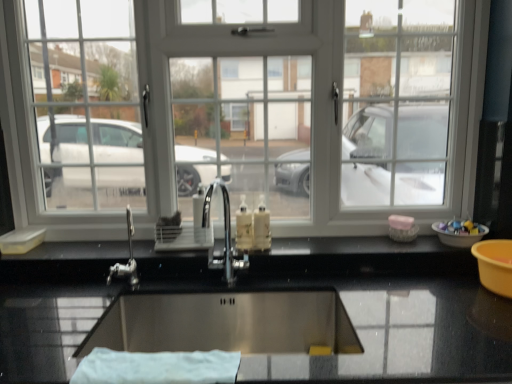
Question: From a real-world perspective, is white cloth at lower center over white plastic bowl at right?

Choices:
 (A) no
 (B) yes

Answer: (A)

Question: Could you tell me if white cloth at lower center is turned towards white plastic bowl at right?

Choices:
 (A) yes
 (B) no

Answer: (B)

Question: Considering the relative sizes of white cloth at lower center and white plastic bowl at right in the image provided, is white cloth at lower center taller than white plastic bowl at right?

Choices:
 (A) yes
 (B) no

Answer: (B)

Question: From a real-world perspective, is white cloth at lower center positioned under white plastic bowl at right based on gravity?

Choices:
 (A) no
 (B) yes

Answer: (B)

Question: Can white plastic bowl at right be found inside white cloth at lower center?

Choices:
 (A) yes
 (B) no

Answer: (B)

Question: Is white cloth at lower center wider or thinner than translucent plastic soap dispenser at center?

Choices:
 (A) wide
 (B) thin

Answer: (A)

Question: Would you say white cloth at lower center is to the left or to the right of translucent plastic soap dispenser at center in the picture?

Choices:
 (A) right
 (B) left

Answer: (B)

Question: Is point (219, 362) positioned closer to the camera than point (249, 211)?

Choices:
 (A) farther
 (B) closer

Answer: (B)

Question: Considering the positions of white cloth at lower center and translucent plastic soap dispenser at center in the image, is white cloth at lower center bigger or smaller than translucent plastic soap dispenser at center?

Choices:
 (A) big
 (B) small

Answer: (A)

Question: Is point (139, 314) positioned closer to the camera than point (449, 109)?

Choices:
 (A) closer
 (B) farther

Answer: (A)

Question: Would you say stainless steel sink at center is inside or outside white plastic window at center?

Choices:
 (A) outside
 (B) inside

Answer: (A)

Question: Is stainless steel sink at center taller or shorter than white plastic window at center?

Choices:
 (A) short
 (B) tall

Answer: (A)

Question: In the image, is stainless steel sink at center positioned in front of or behind white plastic window at center?

Choices:
 (A) front
 (B) behind

Answer: (A)

Question: Considering the positions of white plastic bowl at right and polished chrome tap at center in the image, is white plastic bowl at right bigger or smaller than polished chrome tap at center?

Choices:
 (A) small
 (B) big

Answer: (A)

Question: In terms of height, does white plastic bowl at right look taller or shorter compared to polished chrome tap at center?

Choices:
 (A) short
 (B) tall

Answer: (A)